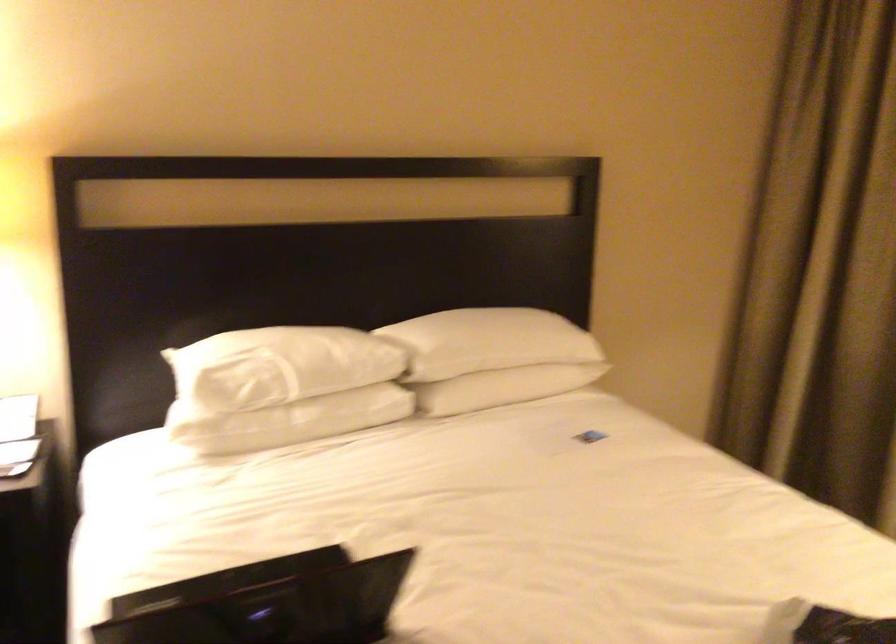
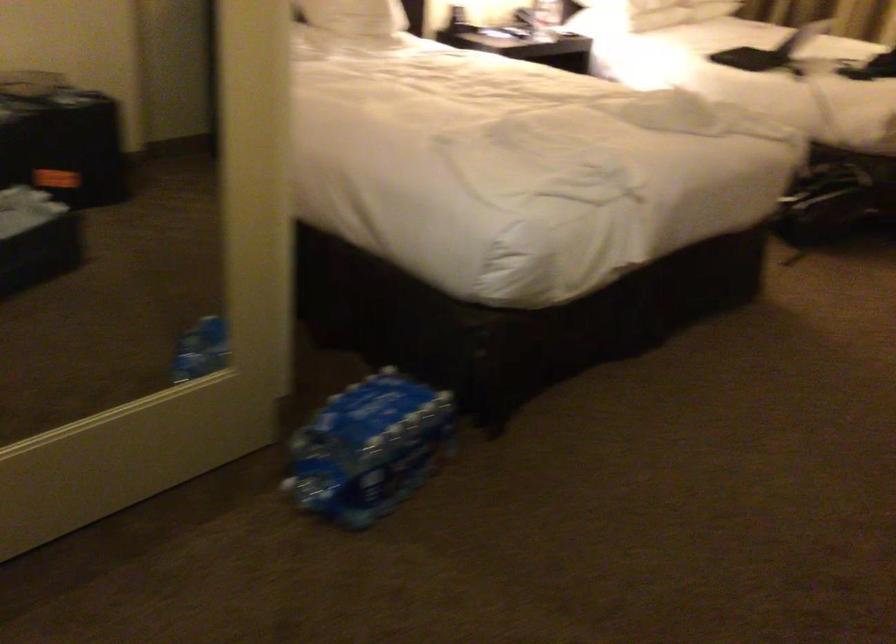
The images are taken continuously from a first-person perspective. In which direction are you moving?

The cameraman moved toward left, backward.